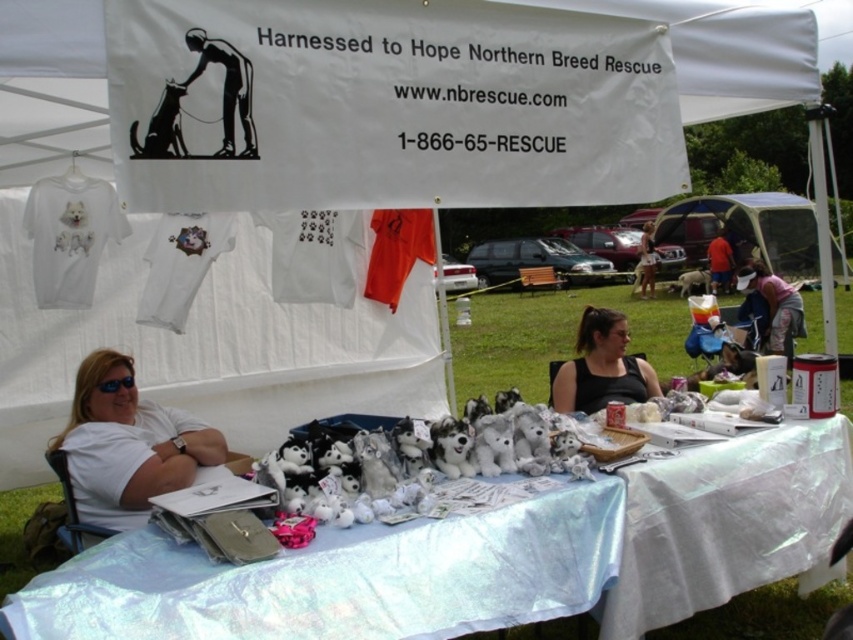
Question: Observing the image, what is the correct spatial positioning of white fabric table at center in reference to white fabric canopy at upper center?

Choices:
 (A) left
 (B) right

Answer: (A)

Question: From the image, what is the correct spatial relationship of white fabric table at center in relation to white t-shirt at lower left?

Choices:
 (A) above
 (B) below

Answer: (B)

Question: Which point is farther to the camera?

Choices:
 (A) white t-shirt at lower left
 (B) black fabric at center

Answer: (B)

Question: Which of these objects is positioned farthest from the white fabric canopy at upper center?

Choices:
 (A) white plush dog at center
 (B) black fabric at center
 (C) pink fabric bag at right

Answer: (A)

Question: Is the position of black fabric at center more distant than that of white plush dog at center?

Choices:
 (A) no
 (B) yes

Answer: (A)

Question: Which object is positioned farthest from the pink fabric bag at right?

Choices:
 (A) light brown hair at center
 (B) white t-shirt at lower left

Answer: (A)